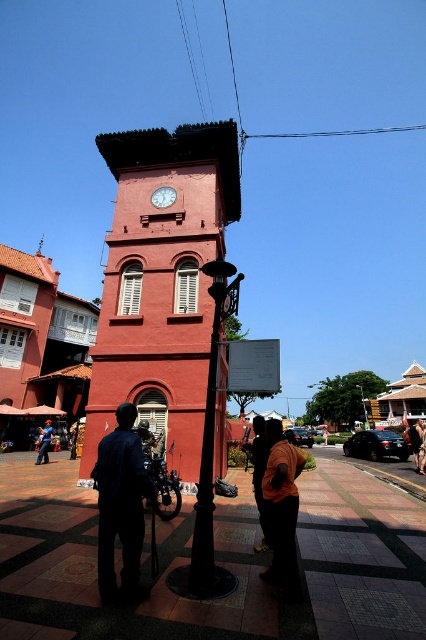
Does point (123, 484) come behind point (226, 282)?

No.

Is point (100, 492) positioned behind point (198, 484)?

No, it is not.

This screenshot has width=426, height=640. What are the coordinates of `dark blue fabric at lower left` in the screenshot? It's located at (120, 508).

In the scene shown: Between orange fabric pants at center and dark brown leather jacket at lower right, which one has more height?

With more height is dark brown leather jacket at lower right.

I want to click on orange fabric pants at center, so click(x=259, y=476).

At what (x,y) coordinates should I click in order to perform the action: click on orange fabric pants at center. Please return your answer as a coordinate pair (x, y). This screenshot has width=426, height=640. Looking at the image, I should click on (259, 476).

Where is `smooth red clock tower at center`? The image size is (426, 640). smooth red clock tower at center is located at coordinates (161, 282).

Which is more to the right, smooth red clock tower at center or black wrought iron lamp post at center?

Positioned to the right is black wrought iron lamp post at center.

Which is behind, point (187, 256) or point (236, 284)?

Point (187, 256)

I want to click on smooth red clock tower at center, so click(161, 282).